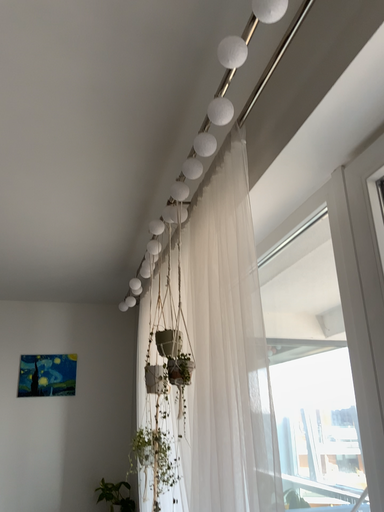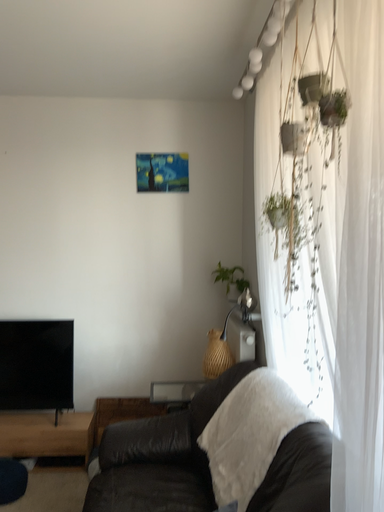
Question: Which way did the camera rotate in the video?

Choices:
 (A) rotated upward
 (B) rotated downward

Answer: (B)